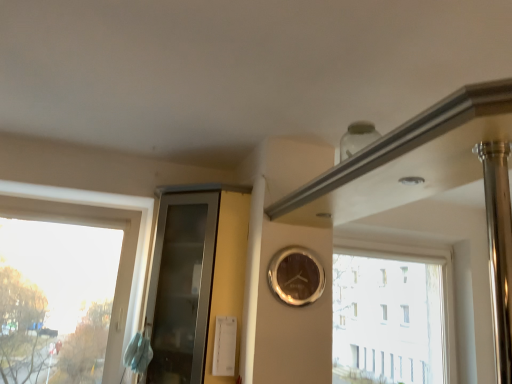
Question: From a real-world perspective, is transparent glass cabinet at center located beneath transparent glass window at upper right, arranged as the 2th window when viewed from the front?

Choices:
 (A) no
 (B) yes

Answer: (A)

Question: Is transparent glass cabinet at center closer to camera compared to transparent glass window at upper right, placed as the first window when sorted from right to left?

Choices:
 (A) yes
 (B) no

Answer: (A)

Question: Would you say transparent glass cabinet at center is outside transparent glass window at upper right, placed as the first window when sorted from right to left?

Choices:
 (A) yes
 (B) no

Answer: (A)

Question: Is transparent glass cabinet at center facing away from transparent glass window at upper right, arranged as the 2th window when viewed from the front?

Choices:
 (A) yes
 (B) no

Answer: (A)

Question: Can you confirm if transparent glass cabinet at center is shorter than transparent glass window at upper right, placed as the first window when sorted from right to left?

Choices:
 (A) no
 (B) yes

Answer: (A)

Question: Is transparent glass cabinet at center to the right of transparent glass window at upper right, the second window when ordered from left to right, from the viewer's perspective?

Choices:
 (A) no
 (B) yes

Answer: (A)

Question: Are transparent glass cabinet at center and shiny gold clock at center located far from each other?

Choices:
 (A) yes
 (B) no

Answer: (B)

Question: Does transparent glass cabinet at center have a greater width compared to shiny gold clock at center?

Choices:
 (A) yes
 (B) no

Answer: (A)

Question: Is transparent glass cabinet at center at the right side of shiny gold clock at center?

Choices:
 (A) no
 (B) yes

Answer: (A)

Question: Is transparent glass cabinet at center turned away from shiny gold clock at center?

Choices:
 (A) yes
 (B) no

Answer: (B)

Question: Considering the relative positions of transparent glass cabinet at center and shiny gold clock at center in the image provided, is transparent glass cabinet at center in front of shiny gold clock at center?

Choices:
 (A) yes
 (B) no

Answer: (A)

Question: From a real-world perspective, is transparent glass cabinet at center on shiny gold clock at center?

Choices:
 (A) yes
 (B) no

Answer: (B)

Question: Is transparent glass window at left, acting as the 1th window starting from the front, a part of shiny gold clock at center?

Choices:
 (A) yes
 (B) no

Answer: (B)